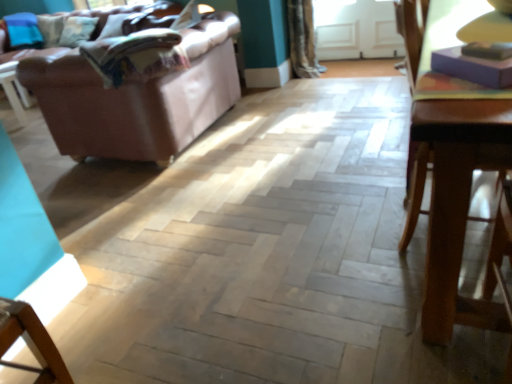
Question: From a real-world perspective, is textured beige curtain at upper center positioned above or below purple matte book at upper right?

Choices:
 (A) below
 (B) above

Answer: (A)

Question: Does point (307, 54) appear closer or farther from the camera than point (499, 44)?

Choices:
 (A) farther
 (B) closer

Answer: (A)

Question: Based on their relative distances, which object is nearer to the purple matte book at upper right?

Choices:
 (A) textured beige curtain at upper center
 (B) brown leather couch at upper left
 (C) transparent glass door at upper center
 (D) wooden table at right

Answer: (D)

Question: Based on their relative distances, which object is nearer to the brown leather couch at upper left?

Choices:
 (A) purple matte book at upper right
 (B) transparent glass door at upper center
 (C) wooden table at right
 (D) textured beige curtain at upper center

Answer: (D)